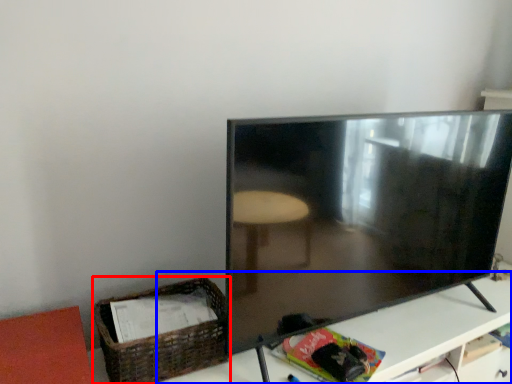
Question: Which object is closer to the camera taking this photo, basket (highlighted by a red box) or table (highlighted by a blue box)?

Choices:
 (A) basket
 (B) table

Answer: (B)